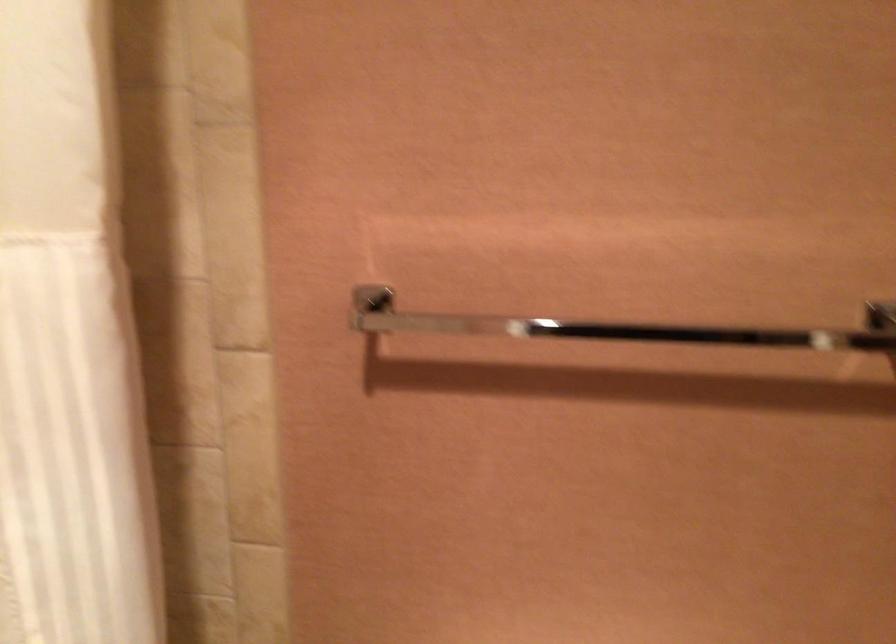
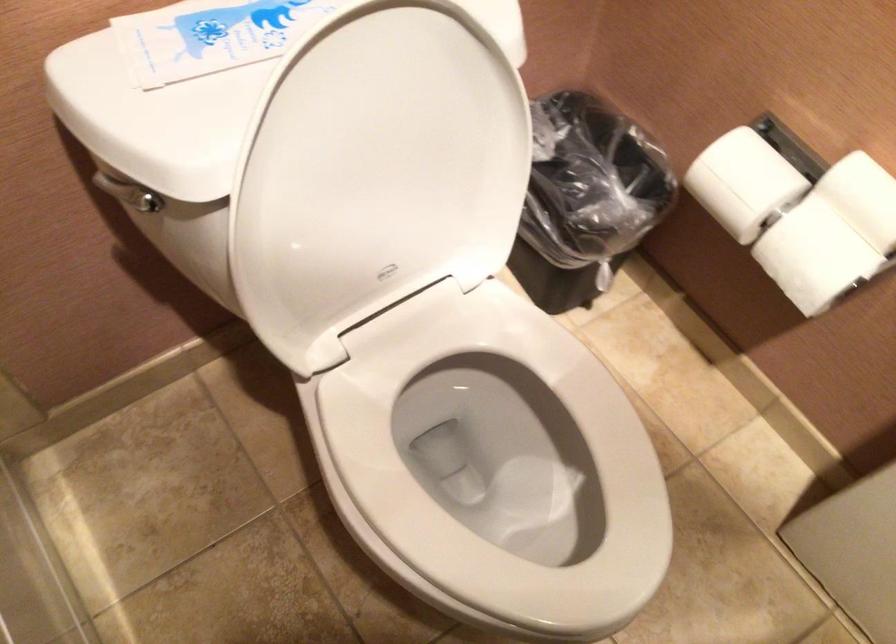
Looking at this image, first-person continuous shooting, in which direction is the camera rotating?

The camera's rotation is toward right-down.